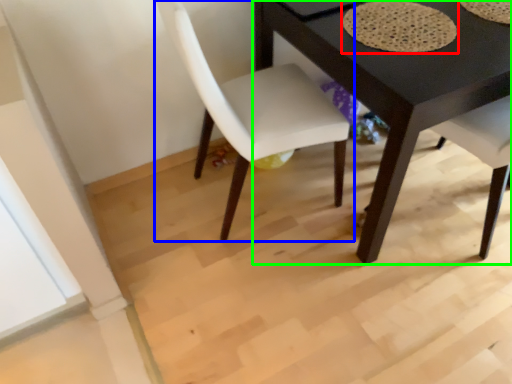
Question: Based on their relative distances, which object is farther from mat (highlighted by a red box)? Choose from chair (highlighted by a blue box) and table (highlighted by a green box).

Choices:
 (A) chair
 (B) table

Answer: (A)